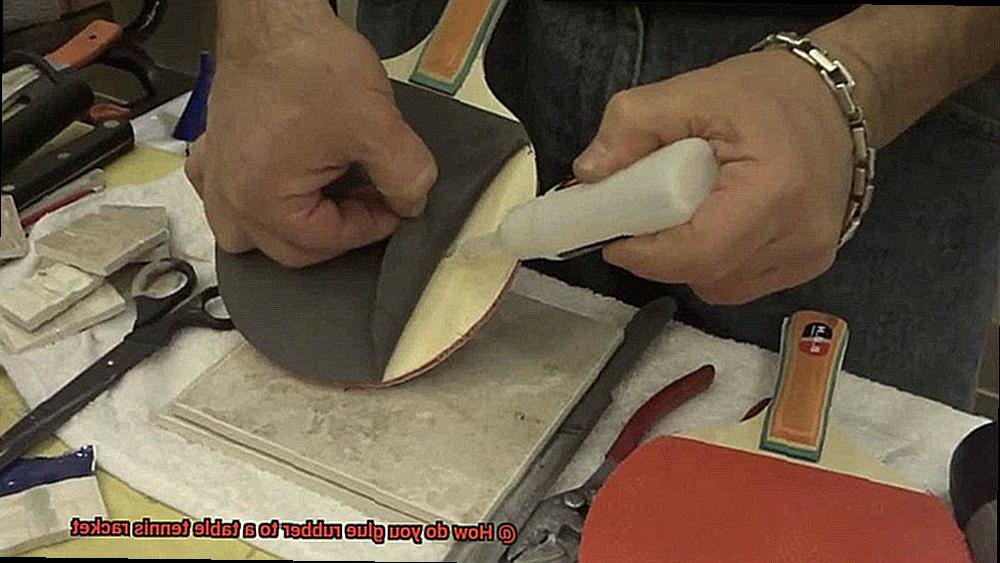
At what (x,y) coordinates should I click in order to perform the action: click on glue bottle. Please return your answer as a coordinate pair (x, y). Looking at the image, I should click on (571, 226).